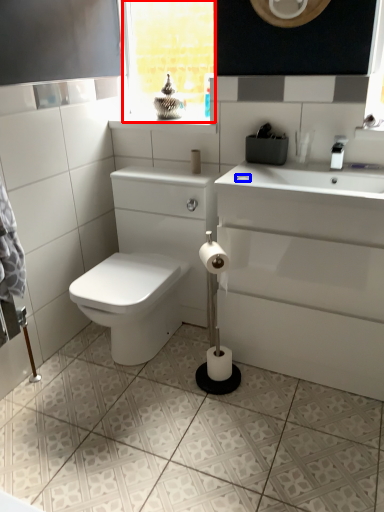
Question: Among these objects, which one is farthest to the camera, window frame (highlighted by a red box) or soap (highlighted by a blue box)?

Choices:
 (A) window frame
 (B) soap

Answer: (A)